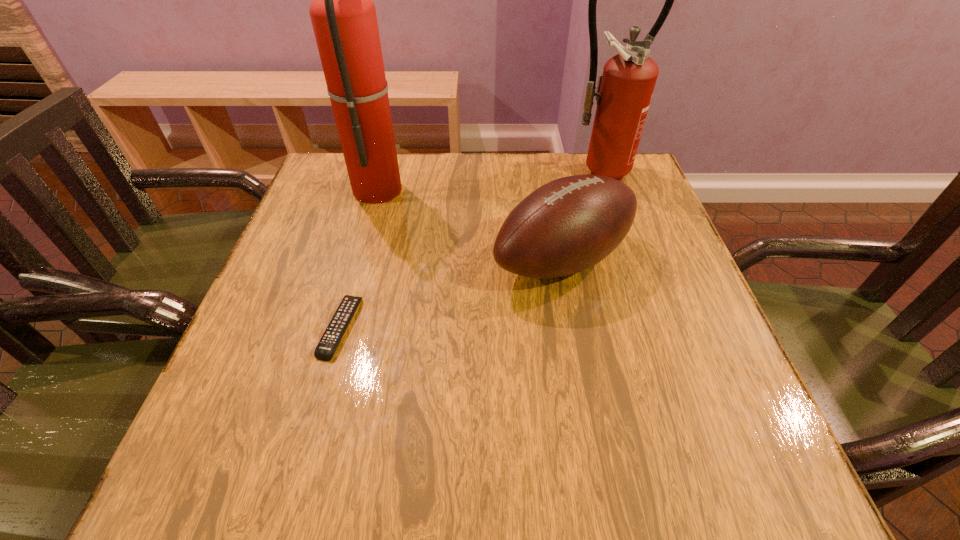
At what (x,y) coordinates should I click in order to perform the action: click on fire extinguisher located at the right edge. Please return your answer as a coordinate pair (x, y). Looking at the image, I should click on (624, 91).

Locate an element on the screen. football (American) at the right edge is located at coordinates (570, 224).

Locate an element on the screen. Image resolution: width=960 pixels, height=540 pixels. object located in the far left corner section of the desktop is located at coordinates (343, 15).

I want to click on object that is at the far right corner, so click(624, 91).

Locate an element on the screen. This screenshot has height=540, width=960. vacant position at the far edge of the desktop is located at coordinates (559, 156).

In the image, there is a desktop. Identify the location of vacant space at the near edge. (555, 443).

At what (x,y) coordinates should I click in order to perform the action: click on blank area at the left edge. Please return your answer as a coordinate pair (x, y). This screenshot has height=540, width=960. Looking at the image, I should click on click(x=286, y=327).

The width and height of the screenshot is (960, 540). What are the coordinates of `vacant space at the right edge of the desktop` in the screenshot? It's located at (655, 213).

This screenshot has height=540, width=960. Identify the location of free space at the far left corner of the desktop. (323, 193).

Find the location of a particular element. This screenshot has width=960, height=540. blank space at the near right corner of the desktop is located at coordinates (697, 466).